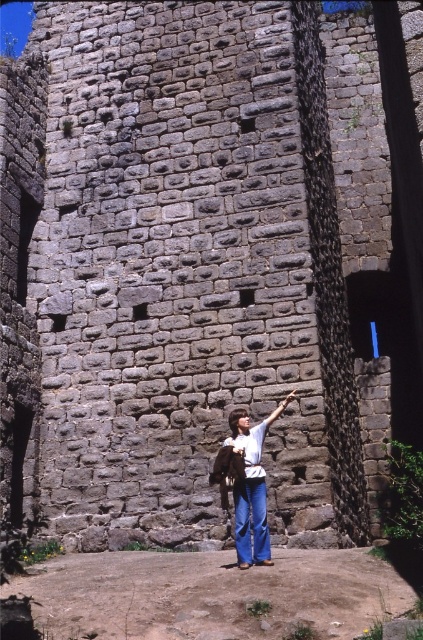
You are observing a person standing in front of an ancient stone wall. The person is wearing denim pants at center and has a matte brown leather arm at center. From your perspective, which item is positioned to the right?

The matte brown leather arm at center is positioned to the right of the denim pants at center.

From the picture: You are an observer standing in front of the stone wall. You notice two items at the center of the image. Which one is smaller in size between the denim pants at center and the matte brown leather arm at center?

The denim pants at center has a smaller size compared to the matte brown leather arm at center, so the denim pants at center is smaller.